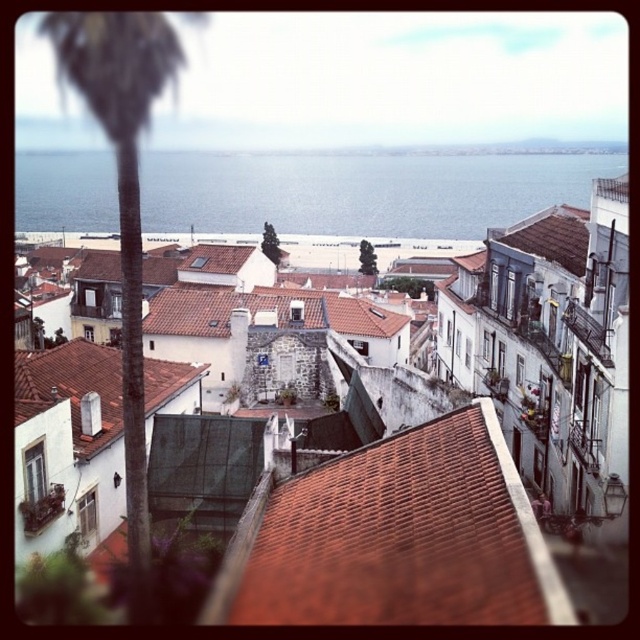
Question: Which point appears farthest from the camera in this image?

Choices:
 (A) 582,188
 (B) 577,228

Answer: (A)

Question: Which point appears closest to the camera in this image?

Choices:
 (A) (544, 248)
 (B) (544, 276)

Answer: (B)

Question: In this image, where is brown tile roof at center located relative to blue water at center?

Choices:
 (A) left
 (B) right

Answer: (B)

Question: Is brown tiled roof at center to the left of green leafy palm tree at left from the viewer's perspective?

Choices:
 (A) no
 (B) yes

Answer: (A)

Question: Which point is closer to the camera?

Choices:
 (A) blue water at center
 (B) green leafy palm tree at left
 (C) brown tile roof at upper right
 (D) brown tiled roof at center

Answer: (D)

Question: Can you confirm if brown tiled roof at center is positioned to the left of blue water at center?

Choices:
 (A) yes
 (B) no

Answer: (B)